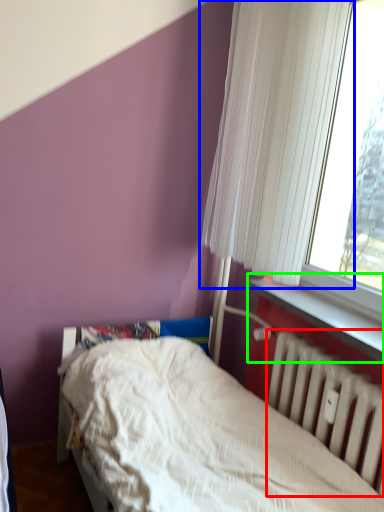
Question: Based on their relative distances, which object is nearer to radiator (highlighted by a red box)? Choose from curtain (highlighted by a blue box) and window sill (highlighted by a green box).

Choices:
 (A) curtain
 (B) window sill

Answer: (B)